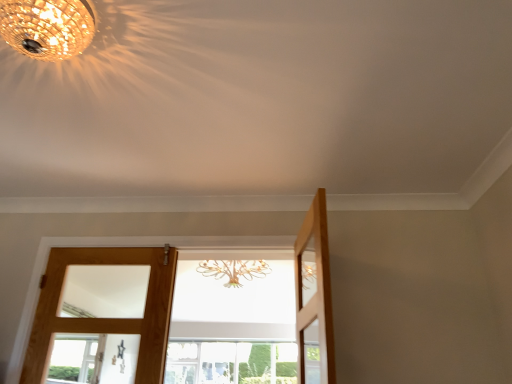
Question: Does crystal chandelier at upper left contain light brown wooden door at left, which appears as the first door when viewed from the left?

Choices:
 (A) no
 (B) yes

Answer: (A)

Question: Considering the relative positions of crystal chandelier at upper left and light brown wooden door at left, the third door when ordered from right to left, in the image provided, is crystal chandelier at upper left in front of light brown wooden door at left, the third door when ordered from right to left,?

Choices:
 (A) yes
 (B) no

Answer: (A)

Question: Is crystal chandelier at upper left turned away from light brown wooden door at left, which appears as the first door when viewed from the left?

Choices:
 (A) no
 (B) yes

Answer: (A)

Question: Does crystal chandelier at upper left have a lesser height compared to light brown wooden door at left, which appears as the first door when viewed from the left?

Choices:
 (A) no
 (B) yes

Answer: (B)

Question: Is crystal chandelier at upper left outside light brown wooden door at left, the third door when ordered from right to left?

Choices:
 (A) no
 (B) yes

Answer: (B)

Question: Considering the positions of wooden door at center, the second door in the left-to-right sequence, and light brown wooden door at right, positioned as the 3th door in left-to-right order, in the image, is wooden door at center, the second door in the left-to-right sequence, taller or shorter than light brown wooden door at right, positioned as the 3th door in left-to-right order,?

Choices:
 (A) short
 (B) tall

Answer: (B)

Question: Would you say wooden door at center, the second door in the left-to-right sequence, is to the left or to the right of light brown wooden door at right, the 1th door when ordered from right to left, in the picture?

Choices:
 (A) left
 (B) right

Answer: (A)

Question: Relative to light brown wooden door at right, positioned as the 3th door in left-to-right order, is wooden door at center, the second door in the left-to-right sequence, in front or behind?

Choices:
 (A) front
 (B) behind

Answer: (B)

Question: Considering the positions of wooden door at center, acting as the second door starting from the right, and light brown wooden door at right, positioned as the 3th door in left-to-right order, in the image, is wooden door at center, acting as the second door starting from the right, wider or thinner than light brown wooden door at right, positioned as the 3th door in left-to-right order,?

Choices:
 (A) thin
 (B) wide

Answer: (B)

Question: Does point (309, 226) appear closer or farther from the camera than point (209, 367)?

Choices:
 (A) closer
 (B) farther

Answer: (A)

Question: From their relative heights in the image, would you say light brown wooden door at right, positioned as the 3th door in left-to-right order, is taller or shorter than clear glass window at center?

Choices:
 (A) short
 (B) tall

Answer: (B)

Question: Relative to clear glass window at center, is light brown wooden door at right, the 1th door when ordered from right to left, in front or behind?

Choices:
 (A) front
 (B) behind

Answer: (A)

Question: In terms of size, does light brown wooden door at right, positioned as the 3th door in left-to-right order, appear bigger or smaller than clear glass window at center?

Choices:
 (A) small
 (B) big

Answer: (A)

Question: Visually, is clear glass window at center positioned to the left or to the right of crystal chandelier at upper left?

Choices:
 (A) right
 (B) left

Answer: (A)

Question: From the image's perspective, is clear glass window at center located above or below crystal chandelier at upper left?

Choices:
 (A) above
 (B) below

Answer: (B)